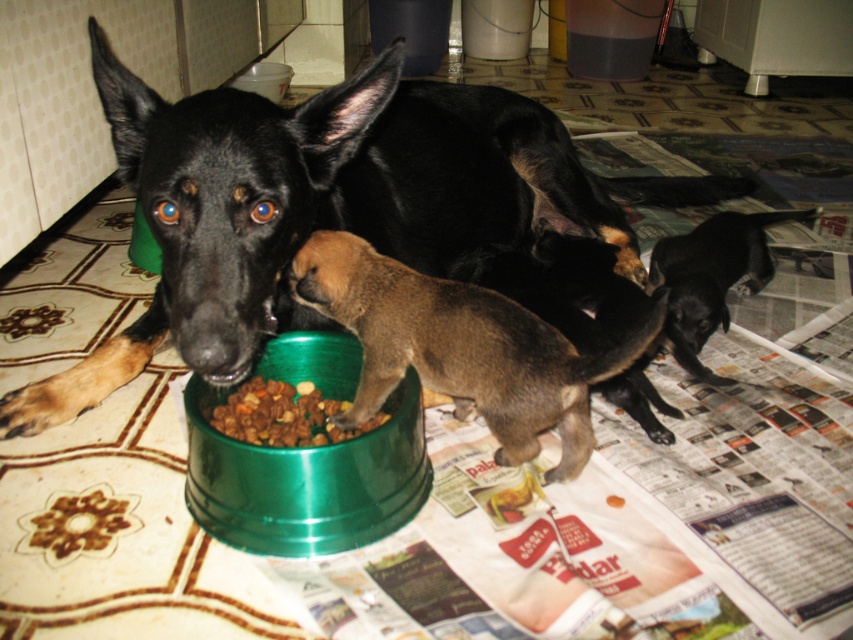
Where is `brown fur puppy at center`? This screenshot has height=640, width=853. brown fur puppy at center is located at coordinates (460, 348).

Can you confirm if brown fur puppy at center is smaller than black smooth coat at lower right?

Correct, brown fur puppy at center occupies less space than black smooth coat at lower right.

Is point (517, 330) farther from camera compared to point (722, 296)?

No, (517, 330) is in front of (722, 296).

This screenshot has width=853, height=640. I want to click on brown fur puppy at center, so click(x=460, y=348).

Which is above, black glossy dog at center or dry kibble at center?

black glossy dog at center is above.

Is black glossy dog at center to the left of dry kibble at center from the viewer's perspective?

No, black glossy dog at center is not to the left of dry kibble at center.

You are a GUI agent. You are given a task and a screenshot of the screen. Output one action in this format:
    pyautogui.click(x=<x>, y=<y>)
    Task: Click on the black glossy dog at center
    This screenshot has width=853, height=640.
    Given the screenshot: What is the action you would take?
    pos(326,204)

The width and height of the screenshot is (853, 640). In order to click on black glossy dog at center in this screenshot , I will do `click(326, 204)`.

Between point (453, 186) and point (244, 506), which one is positioned in front?

Point (244, 506)

Based on the photo, is the position of black glossy dog at center more distant than that of green metallic bowl at center?

No.

Is point (512, 124) positioned before point (276, 554)?

No, it is not.

Find the location of a particular element. black glossy dog at center is located at coordinates (326, 204).